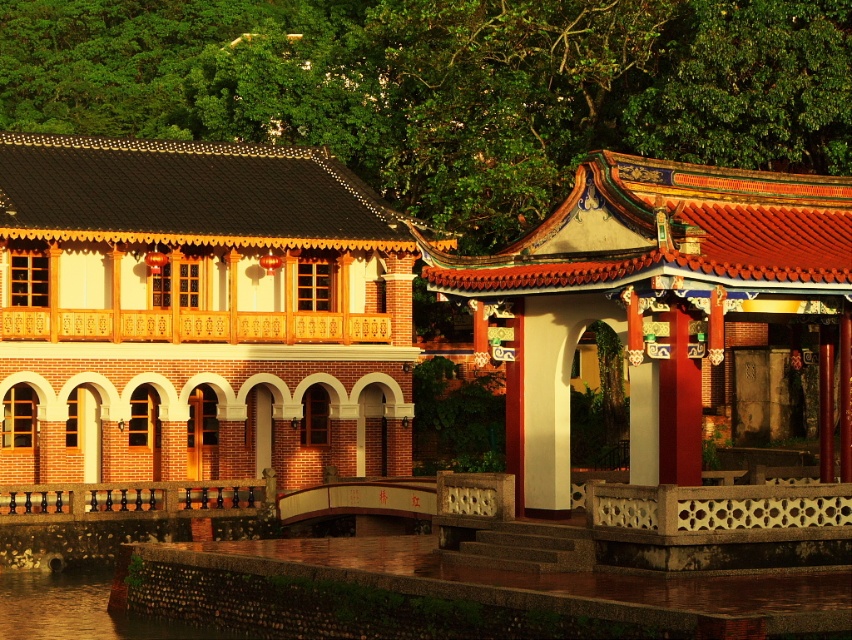
Question: Which of the following is the farthest from the observer?

Choices:
 (A) brick building at left
 (B) reddish-brown stone gazebo at right

Answer: (A)

Question: Which object appears closest to the camera in this image?

Choices:
 (A) brick building at left
 (B) reddish-brown stone gazebo at right

Answer: (B)

Question: Which of the following is the closest to the observer?

Choices:
 (A) (14, 468)
 (B) (671, 212)

Answer: (B)

Question: Can you confirm if brick building at left is wider than reddish-brown stone gazebo at right?

Choices:
 (A) yes
 (B) no

Answer: (A)

Question: Can you confirm if brick building at left is wider than reddish-brown stone gazebo at right?

Choices:
 (A) no
 (B) yes

Answer: (B)

Question: Does brick building at left appear under reddish-brown stone gazebo at right?

Choices:
 (A) yes
 (B) no

Answer: (B)